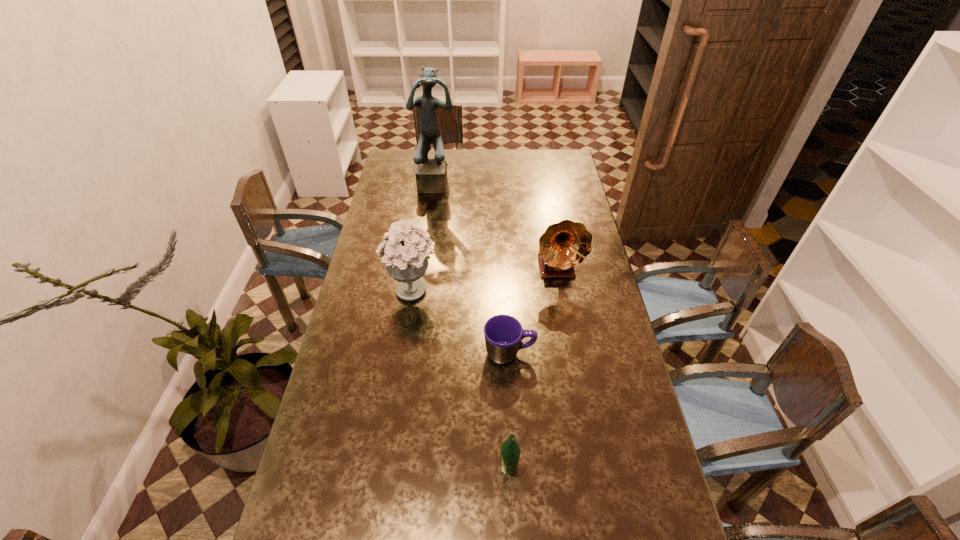
Locate an element on the screen. free region at the far left corner of the desktop is located at coordinates (399, 164).

This screenshot has width=960, height=540. In order to click on free area in between the bottle and the second nearest object in this screenshot , I will do `click(509, 410)`.

At what (x,y) coordinates should I click in order to perform the action: click on free spot between the nearest object and the tallest object. Please return your answer as a coordinate pair (x, y). This screenshot has height=540, width=960. Looking at the image, I should click on click(x=473, y=325).

The image size is (960, 540). Identify the location of free space between the rightmost object and the sculpture. (497, 226).

Identify the location of empty space that is in between the phonograph_record and the farthest object. (497, 226).

This screenshot has width=960, height=540. Find the location of `the third closest object to the bouquet`. the third closest object to the bouquet is located at coordinates (431, 174).

Identify which object is located as the fourth nearest to the fourth farthest object. Please provide its 2D coordinates. Your answer should be formatted as a tuple, i.e. [(x, y)], where the tuple contains the x and y coordinates of a point satisfying the conditions above.

[(431, 174)]

Locate an element on the screen. The height and width of the screenshot is (540, 960). vacant position in the image that satisfies the following two spatial constraints: 1. on the horn of the phonograph_record; 2. with the handle on the side of the shortest object is located at coordinates (571, 353).